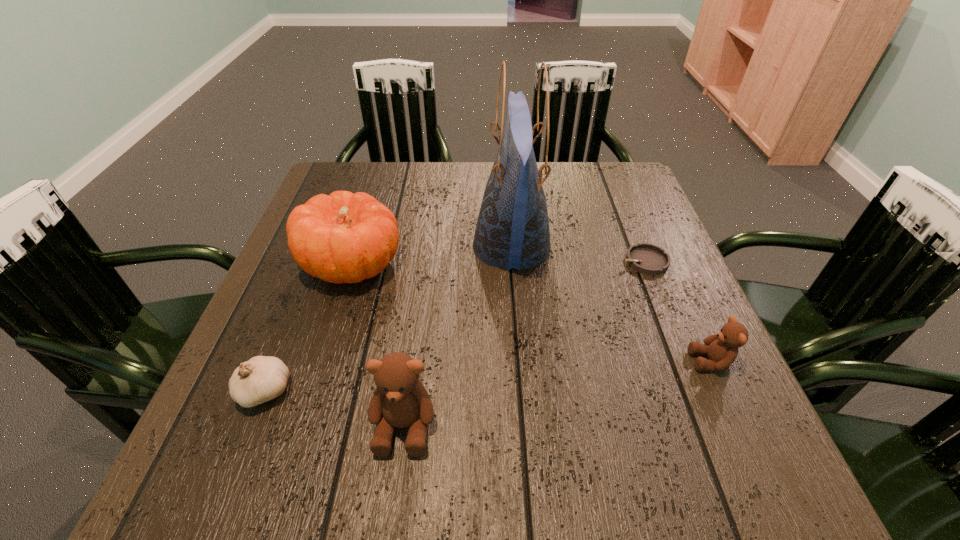
Find the location of a particular element. free space between the pumpkin and the garlic is located at coordinates (308, 327).

Locate an element on the screen. This screenshot has width=960, height=540. vacant point located between the garlic and the tallest object is located at coordinates (388, 319).

Identify the location of vacant space that is in between the garlic and the shorter teddy bear. (488, 376).

Image resolution: width=960 pixels, height=540 pixels. In order to click on empty space between the ashtray and the garlic in this screenshot , I will do `click(455, 326)`.

Where is `free space between the tallest object and the right teddy bear`? free space between the tallest object and the right teddy bear is located at coordinates (612, 304).

Where is `empty space between the left teddy bear and the garlic`? Image resolution: width=960 pixels, height=540 pixels. empty space between the left teddy bear and the garlic is located at coordinates (334, 408).

You are a GUI agent. You are given a task and a screenshot of the screen. Output one action in this format:
    pyautogui.click(x=<x>, y=<y>)
    Task: Click on the free space between the nearer teddy bear and the ashtray
    Image resolution: width=960 pixels, height=540 pixels.
    Given the screenshot: What is the action you would take?
    pyautogui.click(x=524, y=343)

You are a GUI agent. You are given a task and a screenshot of the screen. Output one action in this format:
    pyautogui.click(x=<x>, y=<y>)
    Task: Click on the empty space that is in between the pumpkin and the garlic
    
    Given the screenshot: What is the action you would take?
    pyautogui.click(x=308, y=327)

Select which object is the fourth closest to the garlic. Please provide its 2D coordinates. Your answer should be formatted as a tuple, i.e. [(x, y)], where the tuple contains the x and y coordinates of a point satisfying the conditions above.

[(648, 259)]

Select which object appears as the fifth closest to the taller teddy bear. Please provide its 2D coordinates. Your answer should be formatted as a tuple, i.e. [(x, y)], where the tuple contains the x and y coordinates of a point satisfying the conditions above.

[(648, 259)]